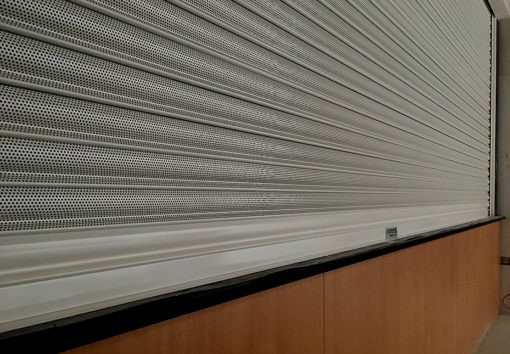
At what (x,y) coordinates should I click in order to perform the action: click on countertop surface. Please return your answer as a coordinate pair (x, y). Looking at the image, I should click on (334, 265).